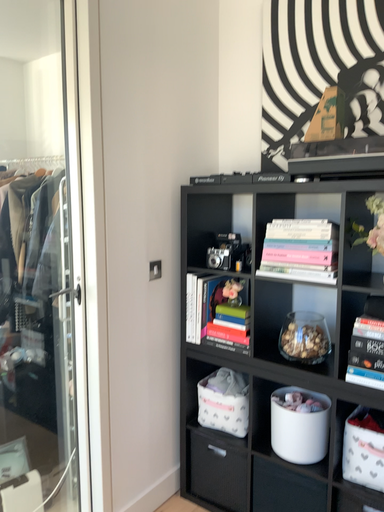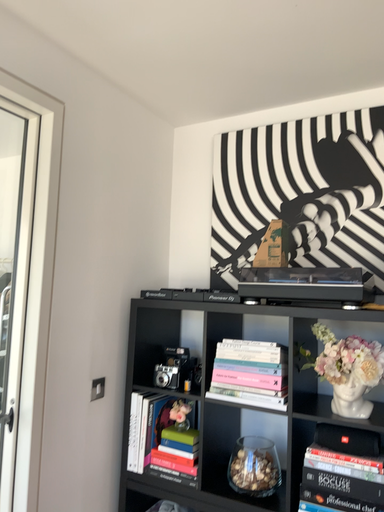
Question: How did the camera likely rotate when shooting the video?

Choices:
 (A) rotated left
 (B) rotated right

Answer: (B)